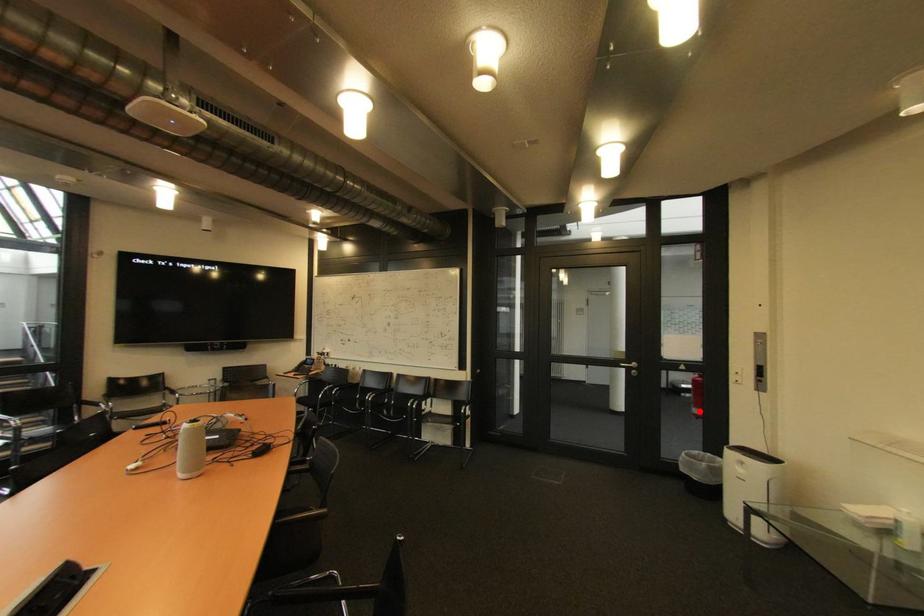
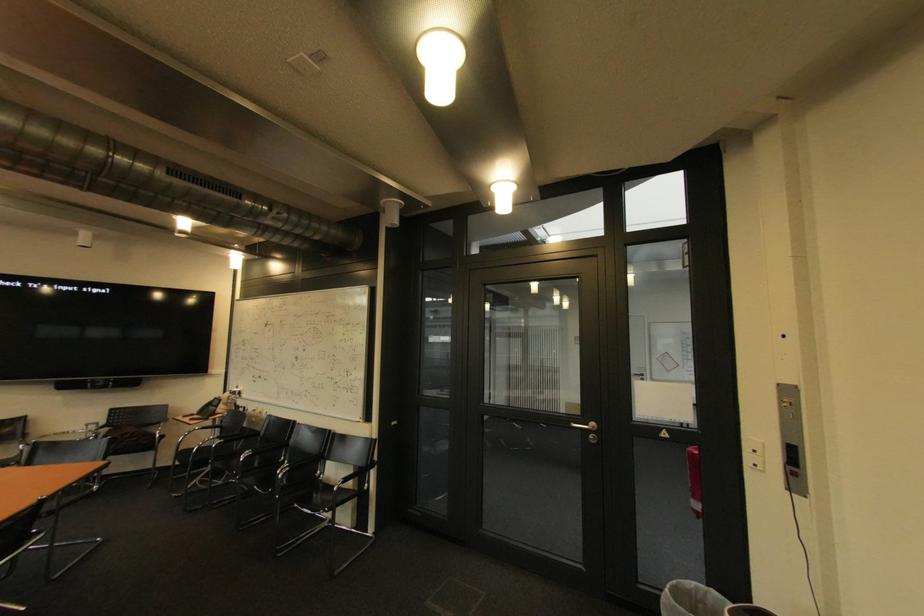
In the second image, find the point that corresponds to the highlighted location in the first image.

(698, 501)